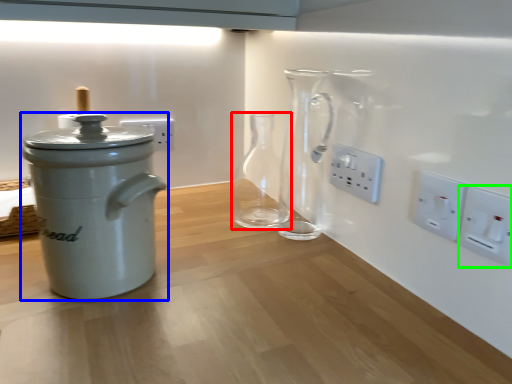
Question: Which object is positioned closest to glass vase (highlighted by a red box)? Select from kitchen appliance (highlighted by a blue box) and electric outlet (highlighted by a green box).

Choices:
 (A) kitchen appliance
 (B) electric outlet

Answer: (A)